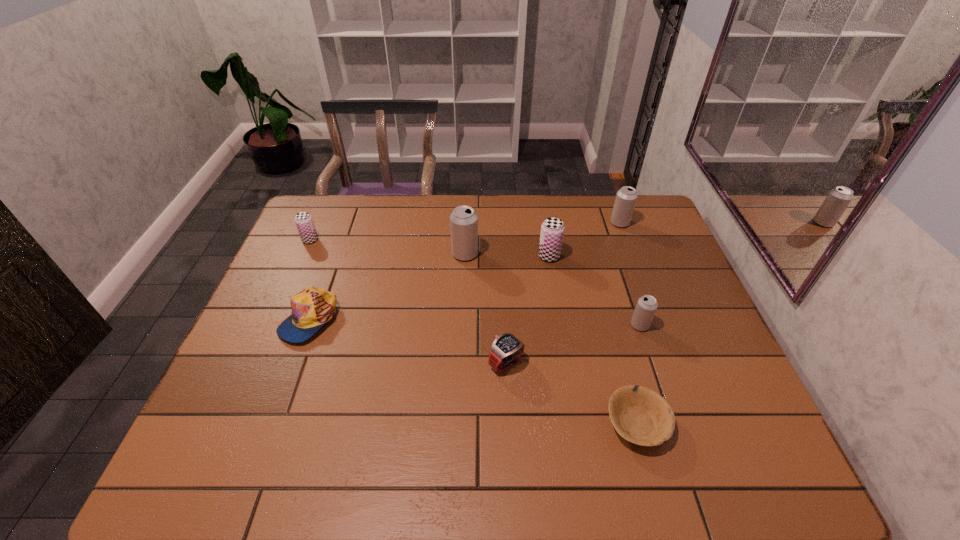
Locate an element on the screen. object that is the seventh closest to the tallest object is located at coordinates (641, 416).

Find the location of `object identified as the fifth closest to the nearest beer can`. object identified as the fifth closest to the nearest beer can is located at coordinates pos(463,220).

Locate an element on the screen. The image size is (960, 540). beer can that stands as the third closest to the nearest white beer can is located at coordinates (463, 220).

Identify which beer can is the fourth nearest to the cap. Please provide its 2D coordinates. Your answer should be formatted as a tuple, i.e. [(x, y)], where the tuple contains the x and y coordinates of a point satisfying the conditions above.

[(646, 307)]

Locate which white beer can is the closest to the farthest white beer can. Please provide its 2D coordinates. Your answer should be formatted as a tuple, i.e. [(x, y)], where the tuple contains the x and y coordinates of a point satisfying the conditions above.

[(646, 307)]

In order to click on white beer can that is the closest one to the watch in this screenshot , I will do `click(646, 307)`.

Locate an element on the screen. vacant space that satisfies the following two spatial constraints: 1. on the front side of the shortest object; 2. on the left side of the left purple beer can is located at coordinates (230, 423).

I want to click on free space in the image that satisfies the following two spatial constraints: 1. on the bill of the nearest white beer can; 2. on the right side of the cap, so click(307, 325).

Find the location of a particular element. This screenshot has width=960, height=540. vacant region that satisfies the following two spatial constraints: 1. on the back side of the nearest beer can; 2. on the right side of the farthest beer can is located at coordinates (606, 223).

The width and height of the screenshot is (960, 540). In order to click on vacant space that satisfies the following two spatial constraints: 1. on the front side of the leftmost beer can; 2. on the right side of the second nearest white beer can in this screenshot , I will do `click(304, 254)`.